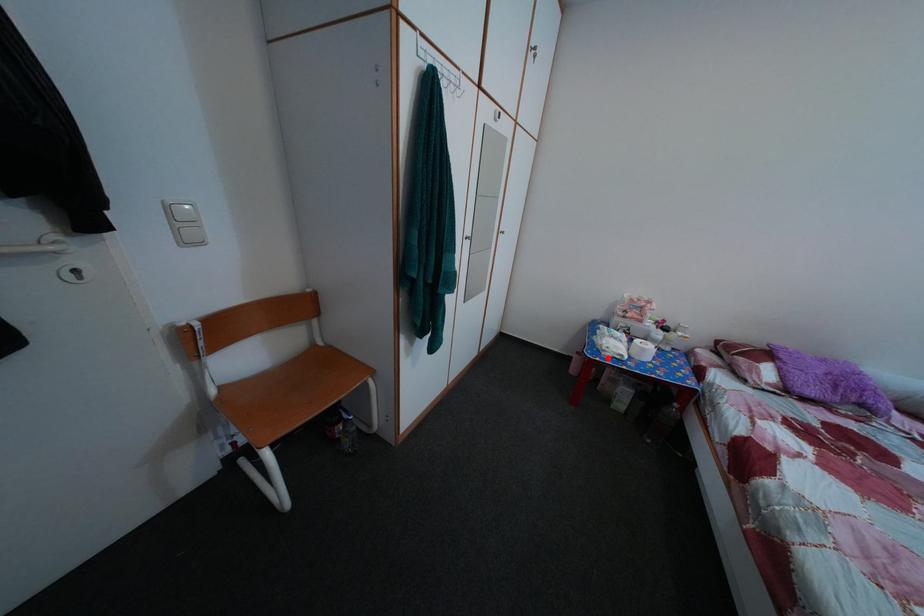
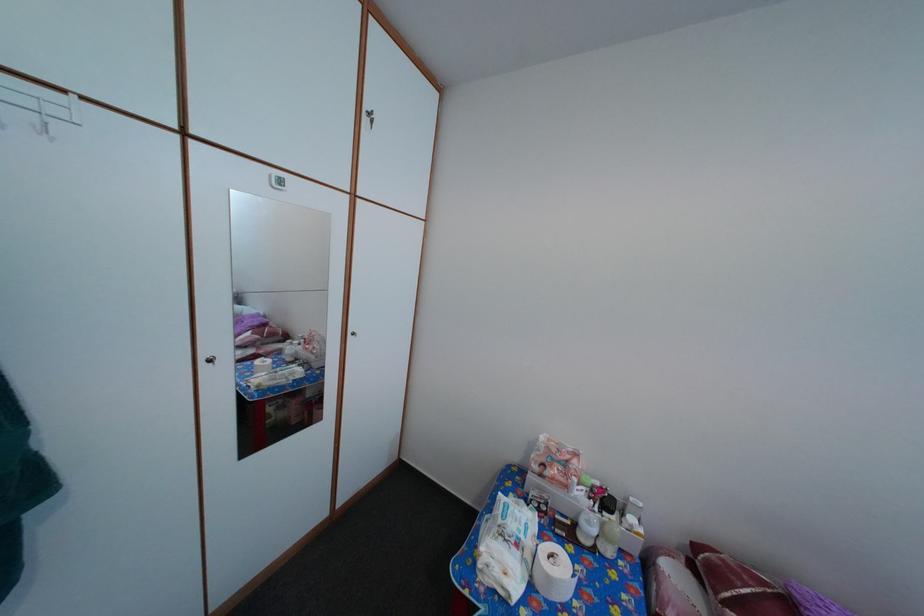
Find the pixel in the second image that matches the highlighted location in the first image.

(484, 572)